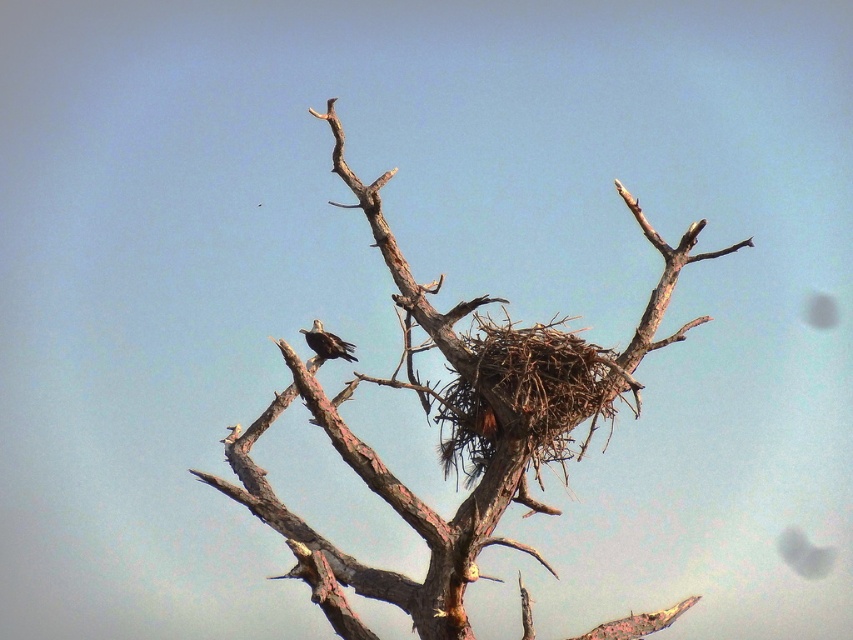
Which is in front, point (450, 524) or point (340, 356)?

Point (450, 524)

Looking at this image, can you confirm if brown/dry wood nest at upper center is thinner than dark brown feathers at center?

In fact, brown/dry wood nest at upper center might be wider than dark brown feathers at center.

I want to click on brown/dry wood nest at upper center, so [456, 426].

Identify the location of brown/dry wood nest at upper center. (456, 426).